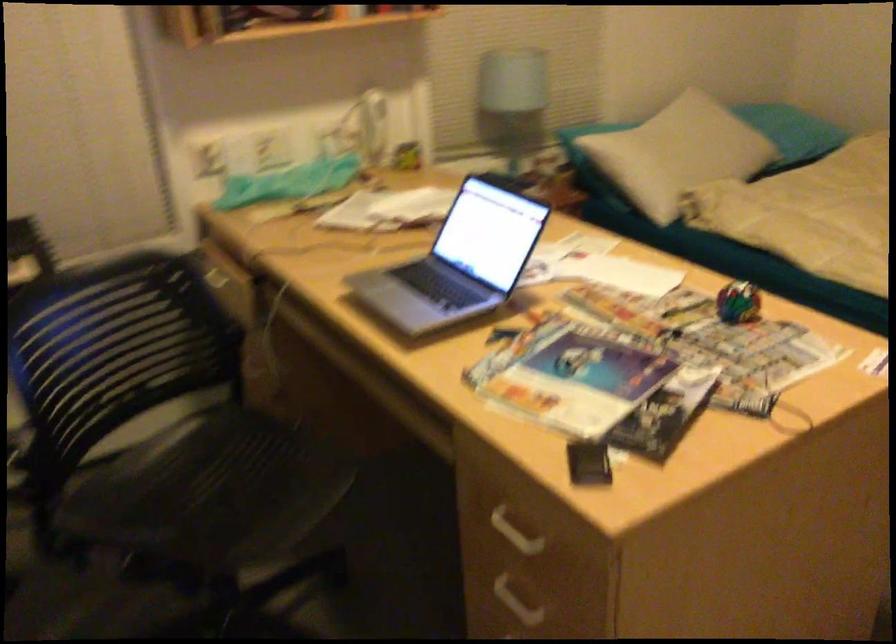
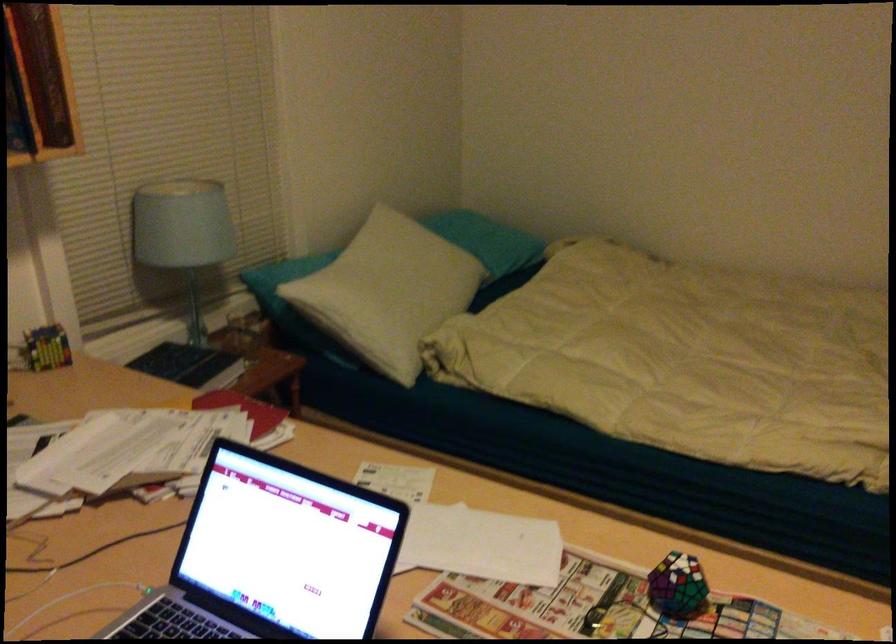
Find the pixel in the second image that matches [666,149] in the first image.

(391, 285)